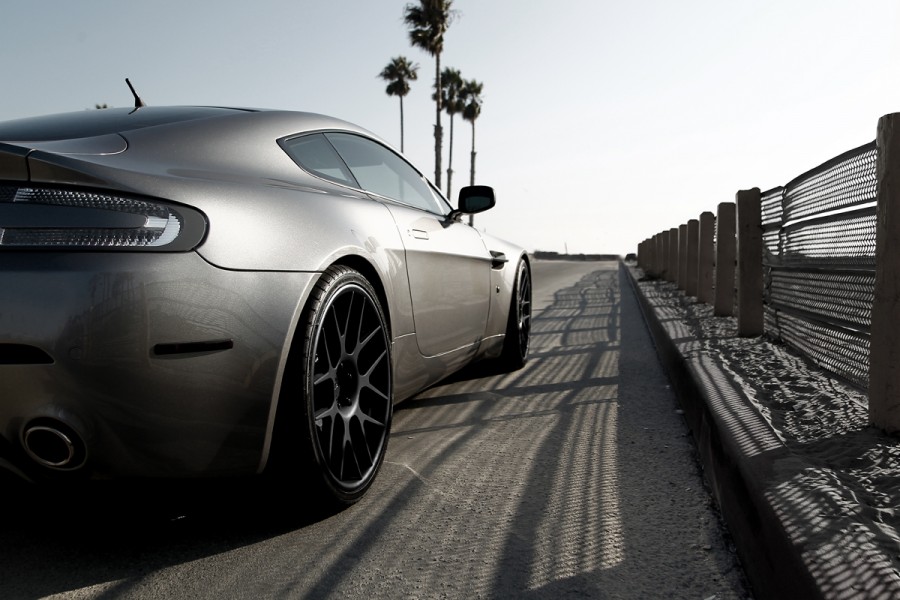
Where is `light`? This screenshot has width=900, height=600. light is located at coordinates (50, 207).